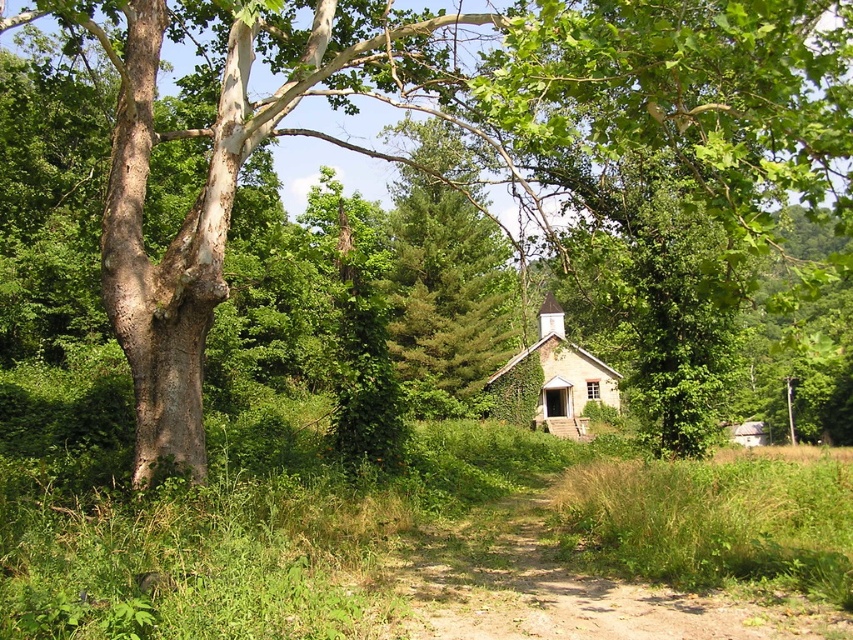
Question: Which is nearer to the green needle-like at center?

Choices:
 (A) brown dirt track at center
 (B) light brown wooden hut at center
 (C) smooth bark tree at left

Answer: (B)

Question: Which point appears farthest from the camera in this image?

Choices:
 (A) (323, 134)
 (B) (556, 385)

Answer: (B)

Question: Considering the relative positions of smooth bark tree at left and brown dirt track at center in the image provided, where is smooth bark tree at left located with respect to brown dirt track at center?

Choices:
 (A) below
 (B) above

Answer: (B)

Question: Can you confirm if brown dirt track at center is wider than light brown wooden hut at center?

Choices:
 (A) no
 (B) yes

Answer: (A)

Question: Which of the following is the farthest from the observer?

Choices:
 (A) smooth bark tree at left
 (B) light brown wooden hut at center

Answer: (B)

Question: Is brown dirt track at center smaller than light brown wooden hut at center?

Choices:
 (A) yes
 (B) no

Answer: (A)